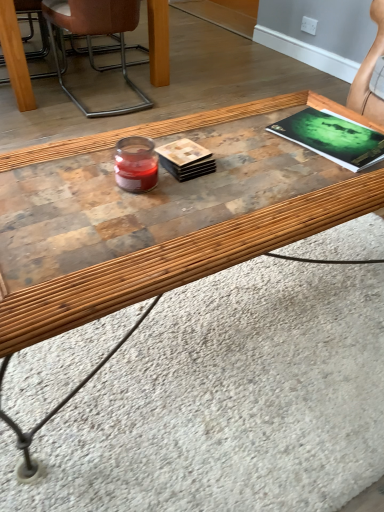
Find the location of a particular element. This screenshot has width=384, height=512. vacant region to the left of green matte magazine at upper right is located at coordinates (252, 150).